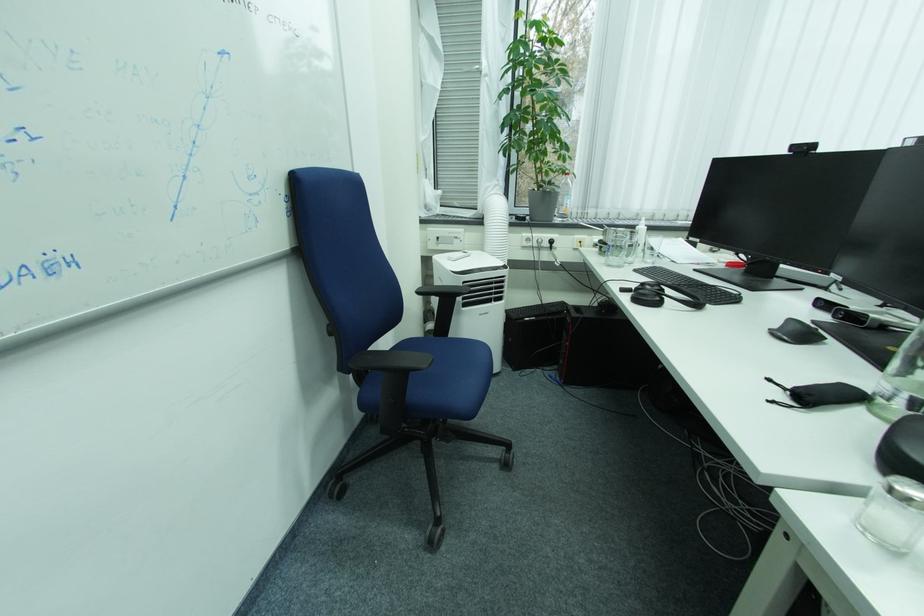
You are a GUI agent. You are given a task and a screenshot of the screen. Output one action in this format:
    pyautogui.click(x=<x>, y=<y>)
    Task: Click on the sanitizer bottle pump
    
    Given the screenshot: What is the action you would take?
    pyautogui.click(x=640, y=237)